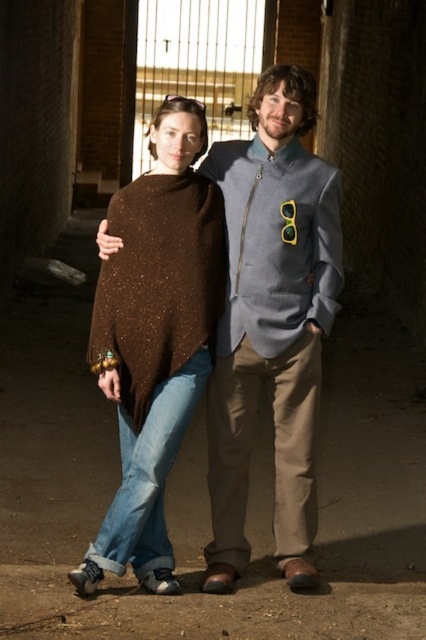
What do you see at coordinates (271, 321) in the screenshot? The width and height of the screenshot is (426, 640). I see `light blue textured jacket at center` at bounding box center [271, 321].

This screenshot has width=426, height=640. What are the coordinates of `light blue textured jacket at center` in the screenshot? It's located at (271, 321).

Which is in front, point (270, 145) or point (97, 346)?

Point (97, 346) is in front.

I want to click on light blue textured jacket at center, so click(x=271, y=321).

Who is higher up, light blue textured jacket at center or brown speckled knit shawl at center?

brown speckled knit shawl at center is higher up.

Consider the image. Between light blue textured jacket at center and brown speckled knit shawl at center, which one has less height?

Standing shorter between the two is brown speckled knit shawl at center.

The image size is (426, 640). What do you see at coordinates (271, 321) in the screenshot? I see `light blue textured jacket at center` at bounding box center [271, 321].

Find the location of `light blue textured jacket at center`. light blue textured jacket at center is located at coordinates (271, 321).

Does brown textured sweater at center have a smaller size compared to brown speckled knit shawl at center?

Incorrect, brown textured sweater at center is not smaller in size than brown speckled knit shawl at center.

Does brown textured sweater at center have a greater width compared to brown speckled knit shawl at center?

Yes.

Who is more distant from viewer, (160, 420) or (138, 381)?

Positioned behind is point (138, 381).

Where is `brown textured sweater at center`? brown textured sweater at center is located at coordinates (155, 337).